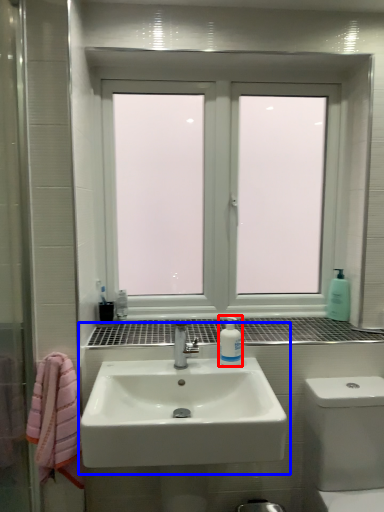
Question: Which object appears closest to the camera in this image, mouthwash (highlighted by a red box) or sink (highlighted by a blue box)?

Choices:
 (A) mouthwash
 (B) sink

Answer: (B)